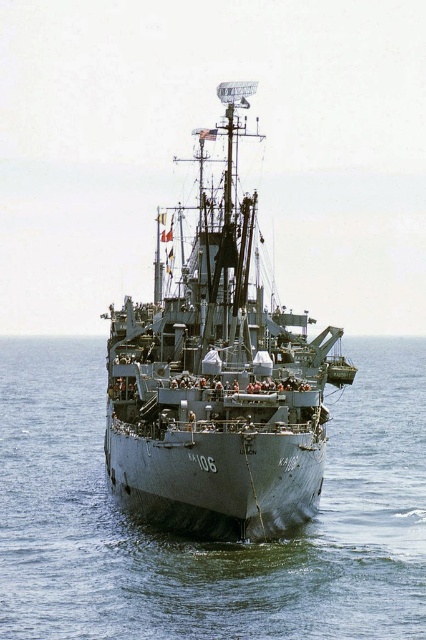
Does gray matte water at center have a lesser height compared to gray metallic ship at center?

Yes, gray matte water at center is shorter than gray metallic ship at center.

Is the position of gray matte water at center less distant than that of gray metallic ship at center?

Yes, gray matte water at center is in front of gray metallic ship at center.

Is point (253, 625) less distant than point (264, 323)?

Yes, it is in front of point (264, 323).

The height and width of the screenshot is (640, 426). I want to click on gray matte water at center, so click(x=206, y=541).